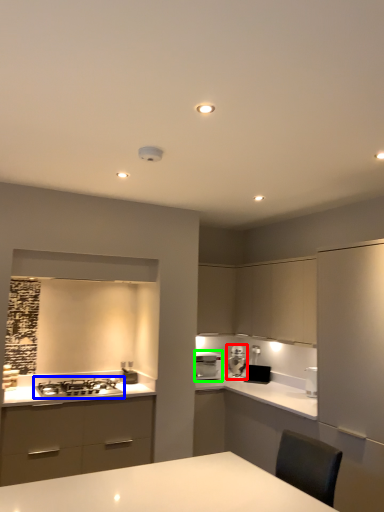
Question: Which is nearer to the kitchen appliance (highlighted by a red box)? gas stove (highlighted by a blue box) or home appliance (highlighted by a green box).

Choices:
 (A) gas stove
 (B) home appliance

Answer: (B)